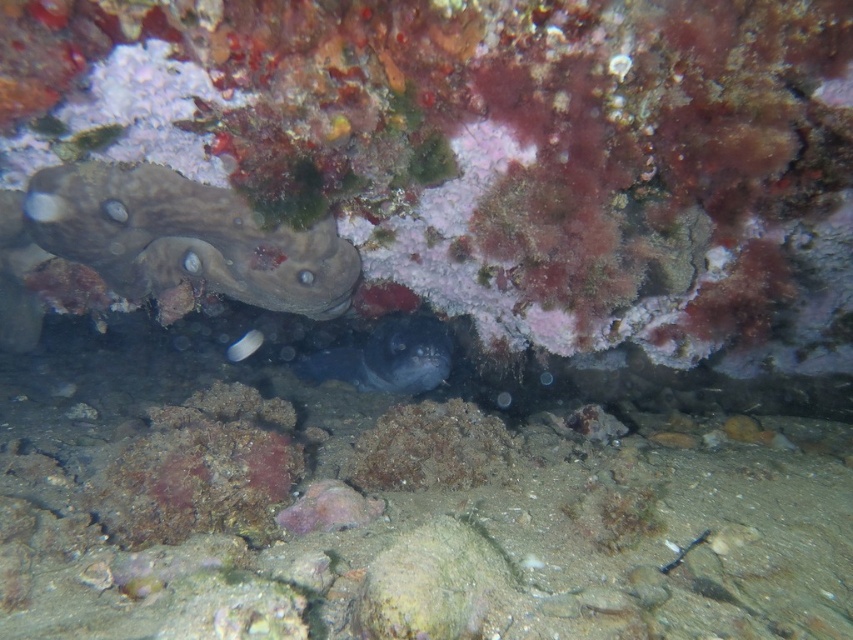
Measure the distance between point (x=318, y=296) and camera.

Point (x=318, y=296) is 6.33 feet away from camera.

What do you see at coordinates (184, 237) in the screenshot?
I see `smooth gray rock at left` at bounding box center [184, 237].

I want to click on smooth gray rock at left, so click(184, 237).